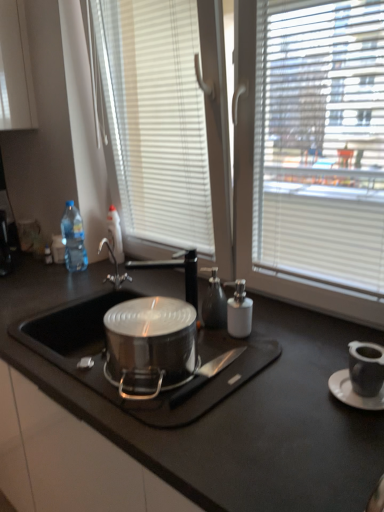
Find the location of a particular element. The width and height of the screenshot is (384, 512). vacant area in front of translucent plastic bottle at upper left, positioned as the 1th bottle in right-to-left order is located at coordinates (91, 275).